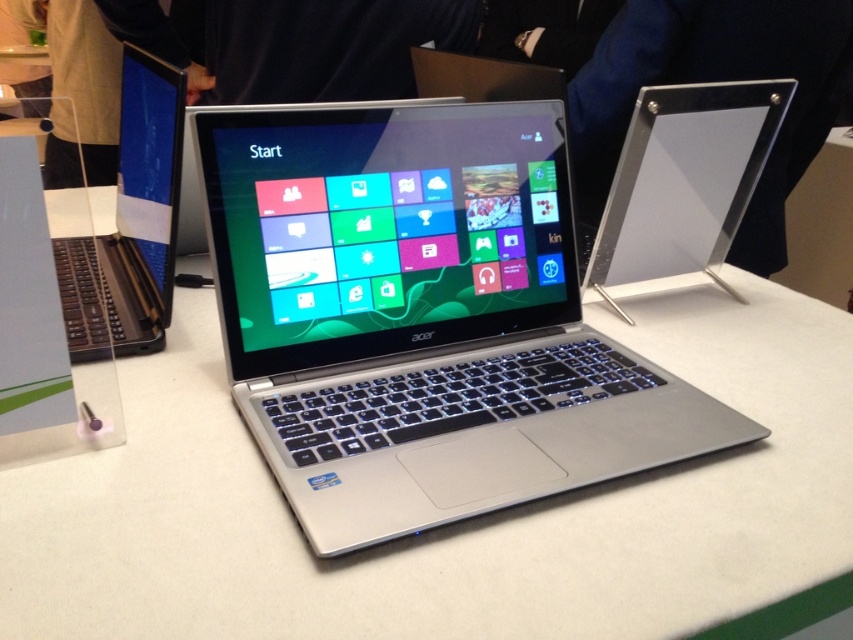
You are standing in front of the display setup and want to place a 16 inch laptop on the white matte counter top at center. Can the laptop fit on the counter top without overhanging the edges?

The distance between the viewer and the white matte counter top at center is 17.14 inches, which is greater than the laptop size of 16 inches. Therefore, the laptop can fit on the counter top without overhanging the edges.

You are standing in front of the display setup with two points marked on the floor. The points are labeled as point (463, 364) and point (117, 269). Which point is closer to you?

Point (463, 364) is in front of point (117, 269), so it is closer to you.

You are setting up a new display for a tech event. You have a white matte counter top at center and a silver metallic laptop at center. Which object is shorter in height?

The white matte counter top at center has a lesser height compared to the silver metallic laptop at center, so the white matte counter top at center is shorter.